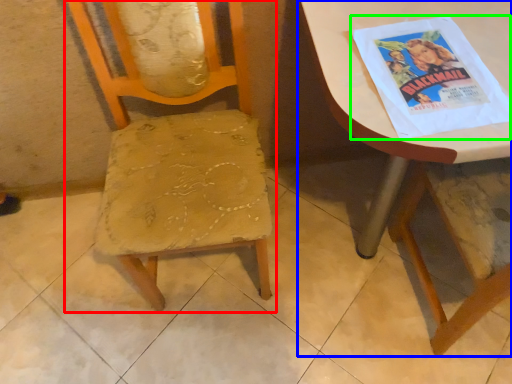
Question: Based on their relative distances, which object is nearer to chair (highlighted by a red box)? Choose from table (highlighted by a blue box) and comic book (highlighted by a green box).

Choices:
 (A) table
 (B) comic book

Answer: (B)